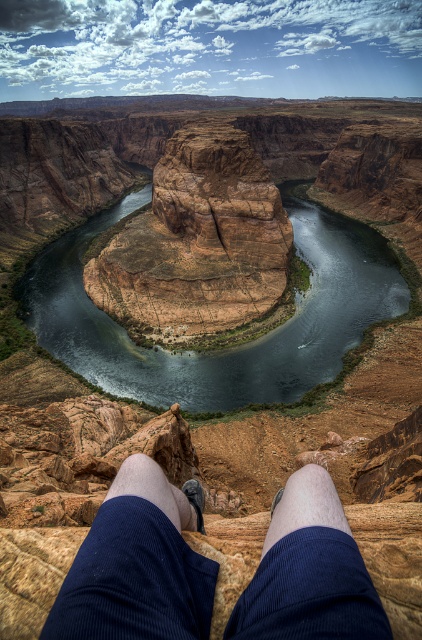
You are a photographer planning to capture the iconic view of Horseshoe Bend. You want to include both the brown rock river at center and the blue corduroy pants at lower center in your shot. Based on their positions, which object should you focus on first to ensure both are in the frame?

The brown rock river at center is located above the blue corduroy pants at lower center, so you should focus on the blue corduroy pants at lower center first to ensure both are in the frame.

You are a photographer trying to capture the brown rock river at center and the blue corduroy pants at lower center in the same frame. Based on their positions, which object should you adjust your camera to focus on first to ensure both are in the shot?

You should focus on the blue corduroy pants at lower center first because the brown rock river at center is to the left of it, so adjusting the camera to include the pants will naturally include the river as well.

You are a photographer planning to capture a photo of the brown rock formation at center and the pale skin at lower center. Based on their heights, which object should you focus on first if you want to ensure both are in the frame without adjusting your camera settings?

The brown rock formation at center is taller than the pale skin at lower center, so you should focus on the brown rock formation at center first to ensure both are in the frame.